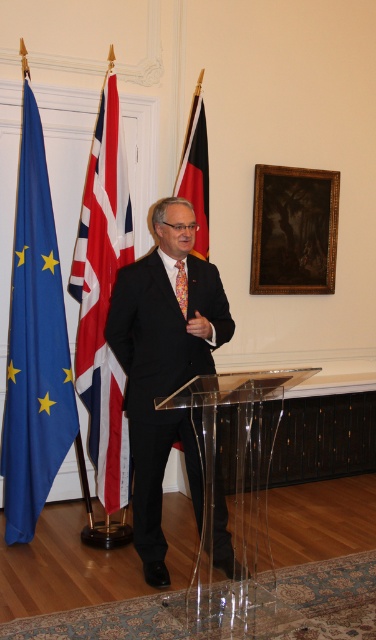
In the scene, there is a man standing at a transparent podium delivering a speech. The podium is located at point (235,502). The flags in the background are the European Union flag on the left, the British flag in the center, and the German flag on the right. If you were to draw a straight line from the man to the German flag, would it pass through the podium?

The point (235,502) indicates the transparent acrylic podium at center. Since the German flag is on the right side of the flags which are to the right of the podium, a straight line from the man at the podium to the German flag would not pass through the podium itself. The podium is at the center, and the German flag is positioned to the right of the flags which are already to the right of the podium. Therefore, the line would go from the podium towards the German flag without intersecting the podium.

You are an event organizer who needs to ensure that the flags are displayed correctly. According to the protocol, the flag on the left must be smaller than the one in the center. Are the red and white striped flag at left and black matte flag at center currently displayed in compliance with this rule?

The red and white striped flag at left is bigger than the black matte flag at center, which violates the protocol requirement that the left flag must be smaller. Therefore, they are not displayed correctly.